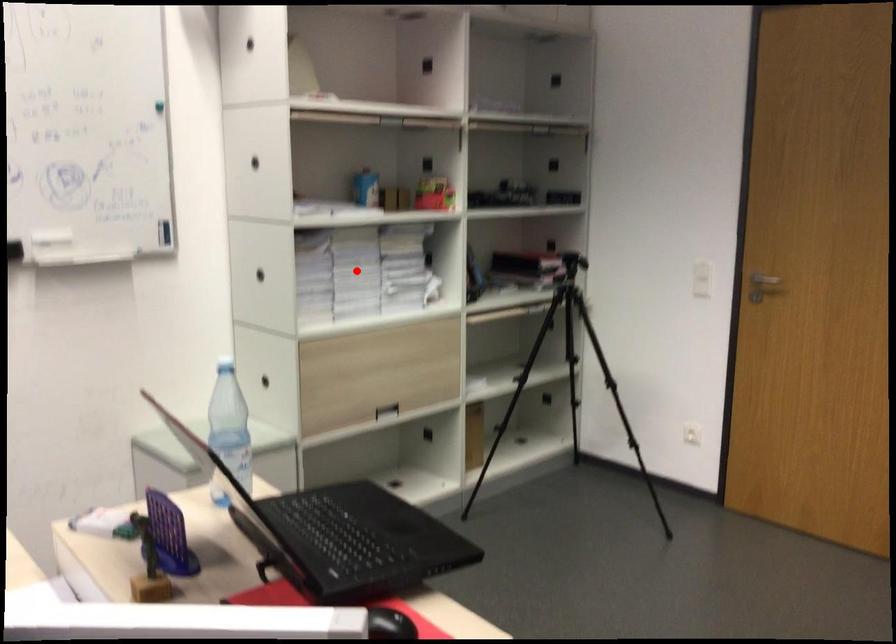
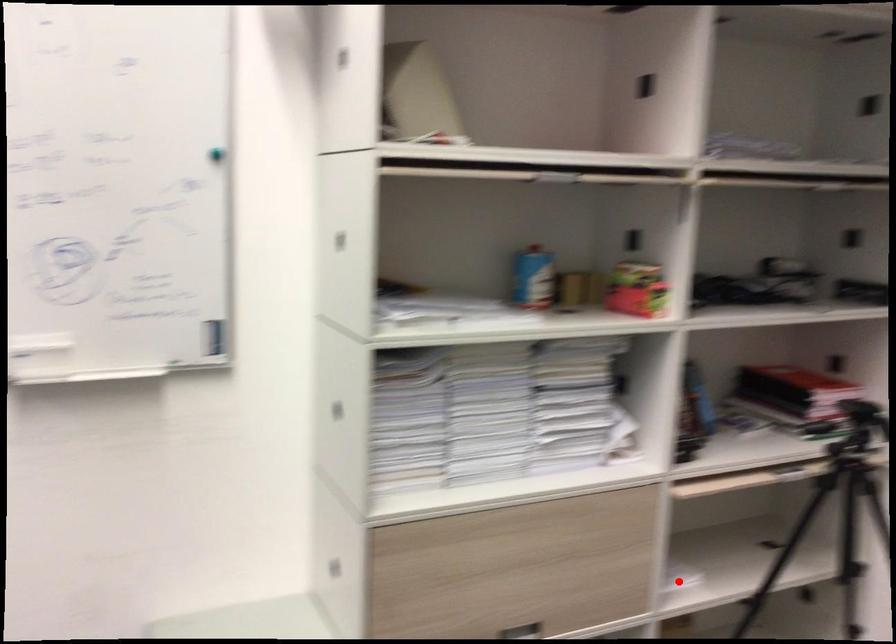
I am providing you with two images of the same scene from different viewpoints. A red point is marked on the first image and another point is marked on the second image. Is the red point in image1 aligned with the point shown in image2?

No